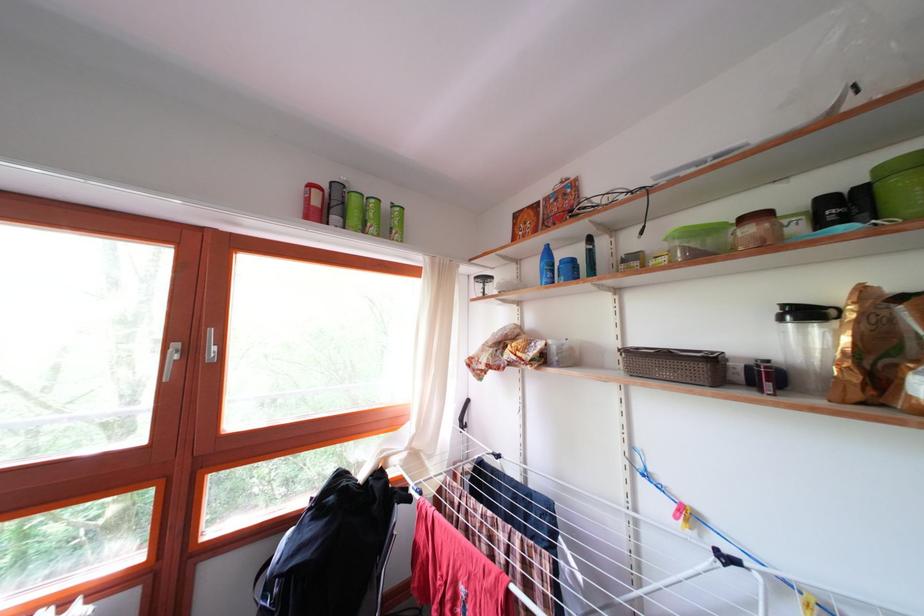
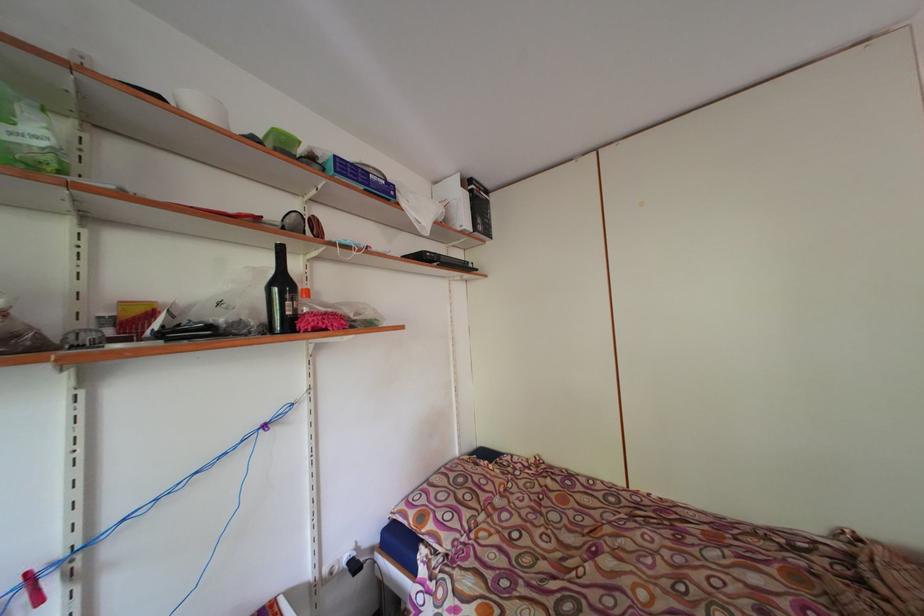
Question: How did the camera likely rotate?

Choices:
 (A) Left
 (B) Right
 (C) Up
 (D) Down

Answer: (B)